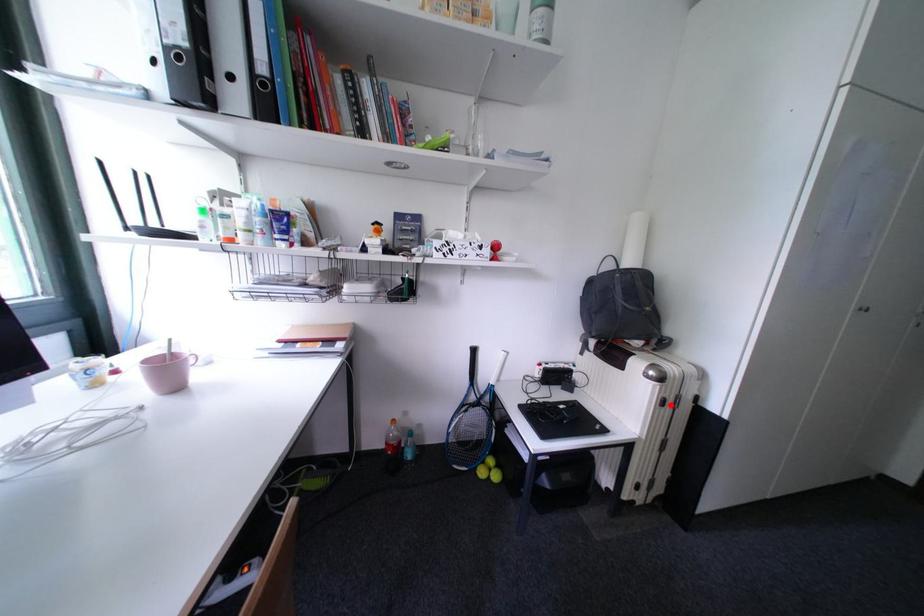
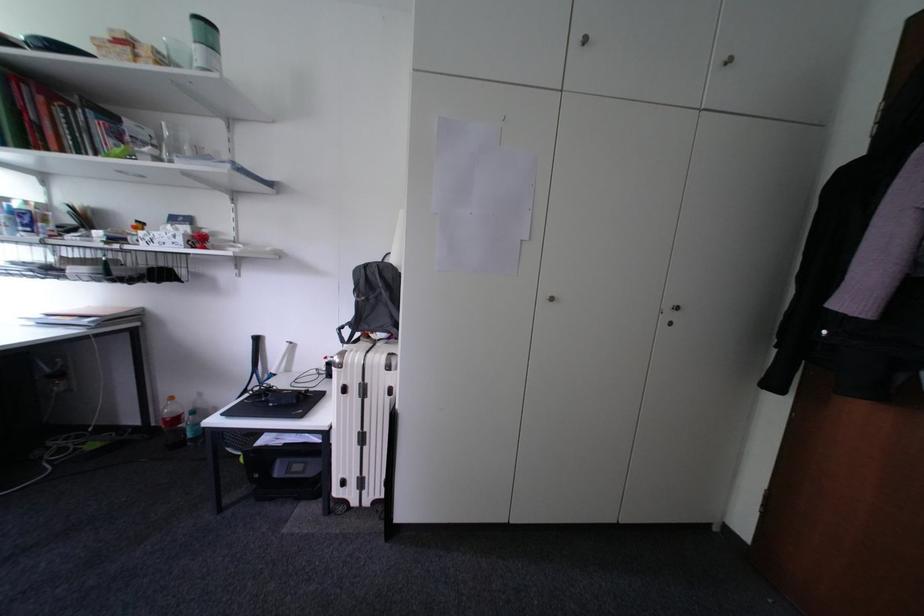
Where in the second image is the point corresponding to the highlighted location from the first image?

(353, 392)